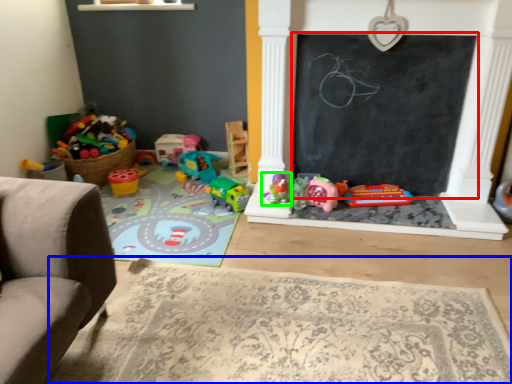
Question: Which object is the farthest from bulletin board (highlighted by a red box)? Choose among these: mat (highlighted by a blue box) or toy (highlighted by a green box).

Choices:
 (A) mat
 (B) toy

Answer: (A)